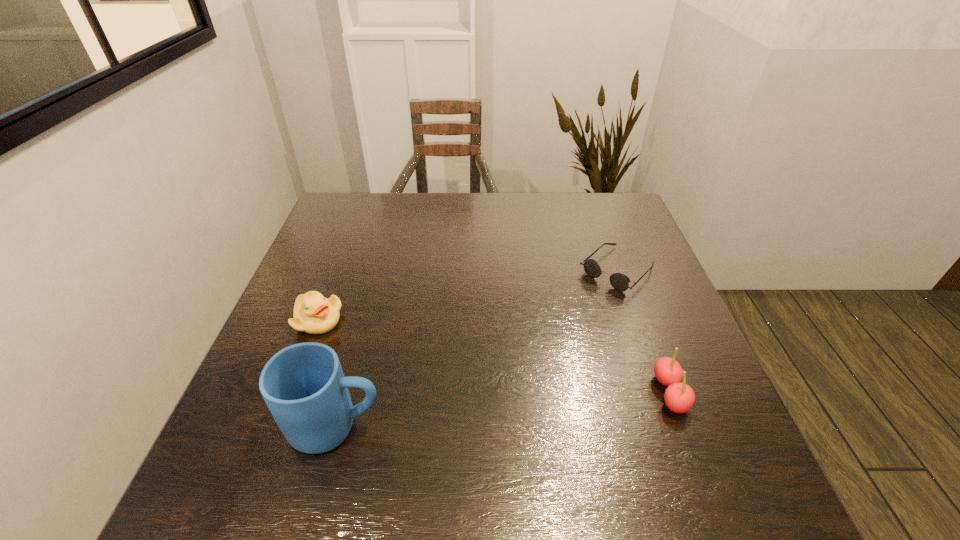
The width and height of the screenshot is (960, 540). I want to click on the tallest object, so click(x=303, y=385).

Image resolution: width=960 pixels, height=540 pixels. I want to click on cherry, so click(679, 397).

Locate an element on the screen. This screenshot has height=540, width=960. duckling is located at coordinates (313, 313).

Where is `the farthest object`? the farthest object is located at coordinates (619, 281).

At what (x,y) coordinates should I click in order to perform the action: click on the shortest object. Please return your answer as a coordinate pair (x, y). The width and height of the screenshot is (960, 540). Looking at the image, I should click on (619, 281).

The height and width of the screenshot is (540, 960). In order to click on free space located 0.260m on the side of the mug with the handle in this screenshot , I will do `click(522, 427)`.

The image size is (960, 540). Find the location of `free space located on the left of the cherry`. free space located on the left of the cherry is located at coordinates (477, 393).

At what (x,y) coordinates should I click in order to perform the action: click on free spot located at the face of the second farthest object. Please return your answer as a coordinate pair (x, y). Looking at the image, I should click on (354, 334).

You are a GUI agent. You are given a task and a screenshot of the screen. Output one action in this format:
    pyautogui.click(x=<x>, y=<y>)
    Task: Click on the vacant space located at the face of the second farthest object
    This screenshot has height=540, width=960.
    Given the screenshot: What is the action you would take?
    pyautogui.click(x=468, y=380)

Where is `free space located 0.370m at the face of the second farthest object`? free space located 0.370m at the face of the second farthest object is located at coordinates (480, 385).